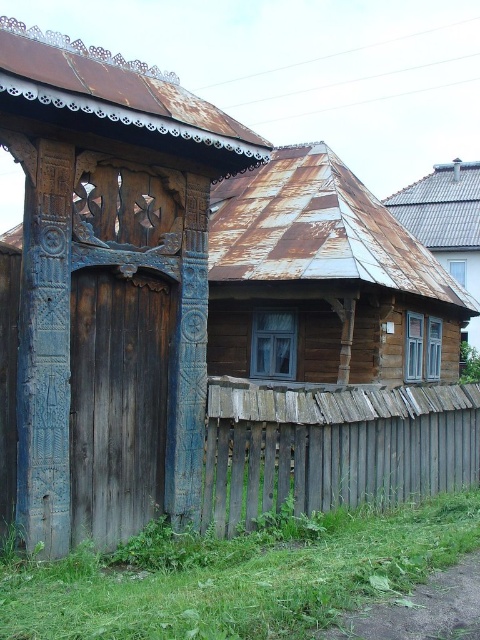
You are a painter who needs to choose between painting the weathered wood fence at center and the rusty metal roof at upper right. If you want to paint the narrower structure first, which one should you start with?

The weathered wood fence at center has a lesser width compared to rusty metal roof at upper right, so you should start with the weathered wood fence at center.

You are a delivery person trying to deliver a package to the blue wood log cabin at left. You are currently standing in front of the weathered wood fence at center. Which direction should you move to reach the cabin?

The blue wood log cabin at left is above the weathered wood fence at center, so you should move upward to reach it.